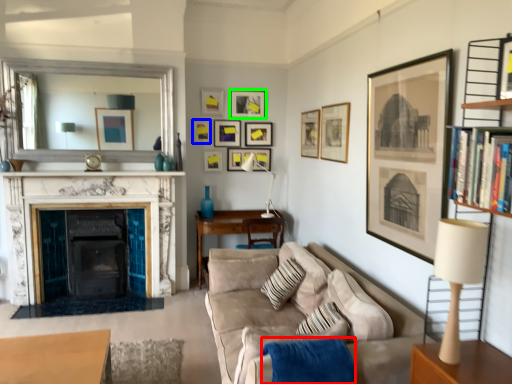
Question: Estimate the real-world distances between objects in this image. Which object is farther from blanket (highlighted by a red box), picture frame (highlighted by a blue box) or picture frame (highlighted by a green box)?

Choices:
 (A) picture frame
 (B) picture frame

Answer: (B)